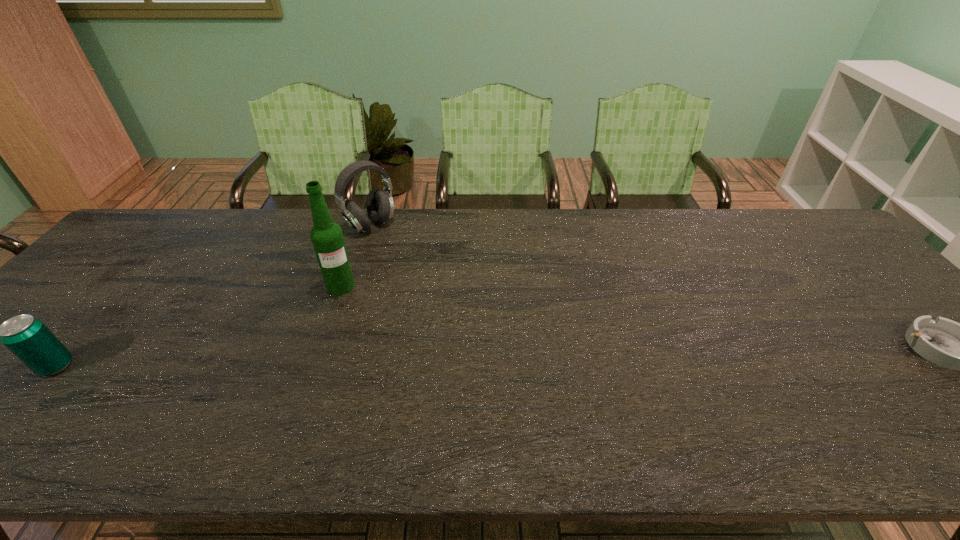
Find the location of `free spot on the desktop that is between the beer can and the rightmost object and is positioned on the label of the third nearest object`. free spot on the desktop that is between the beer can and the rightmost object and is positioned on the label of the third nearest object is located at coordinates (373, 360).

Identify the location of vacant space on the desktop that is between the second shortest object and the shortest object and is positioned on the ear cups of the farthest object. (494, 357).